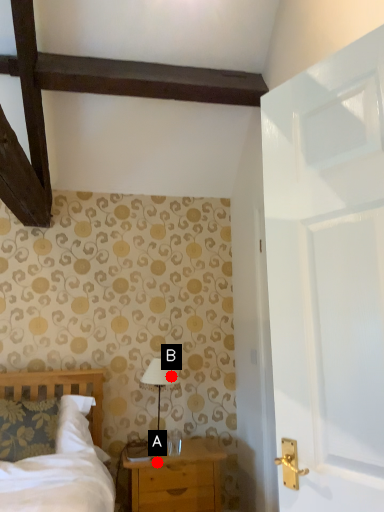
Question: Two points are circled on the image, labeled by A and B beside each circle. Among these points, which one is farthest from the camera?

Choices:
 (A) A is further
 (B) B is further

Answer: (B)